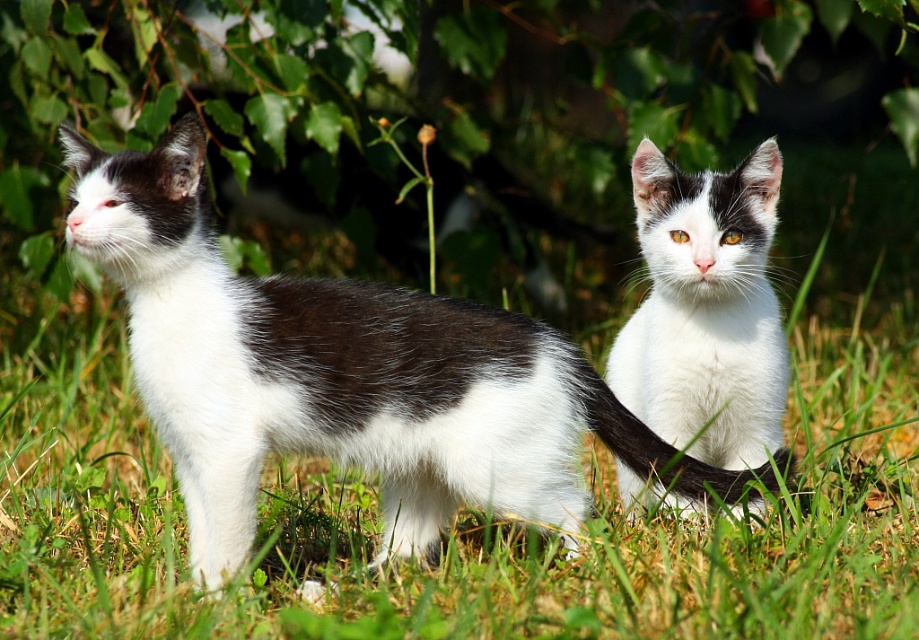
Question: Considering the real-world distances, which object is farthest from the white soft fur cat at center?

Choices:
 (A) black and white fur cat at left
 (B) black fur tail at center

Answer: (A)

Question: Does black and white fur cat at left appear under white soft fur cat at center?

Choices:
 (A) no
 (B) yes

Answer: (B)

Question: In this image, where is black and white fur cat at left located relative to white soft fur cat at center?

Choices:
 (A) below
 (B) above

Answer: (A)

Question: Considering the real-world distances, which object is farthest from the black fur tail at center?

Choices:
 (A) black and white fur cat at left
 (B) white soft fur cat at center

Answer: (A)

Question: Among these points, which one is nearest to the camera?

Choices:
 (A) (483, 364)
 (B) (742, 506)

Answer: (A)

Question: Can you confirm if black and white fur cat at left is thinner than black fur tail at center?

Choices:
 (A) yes
 (B) no

Answer: (B)